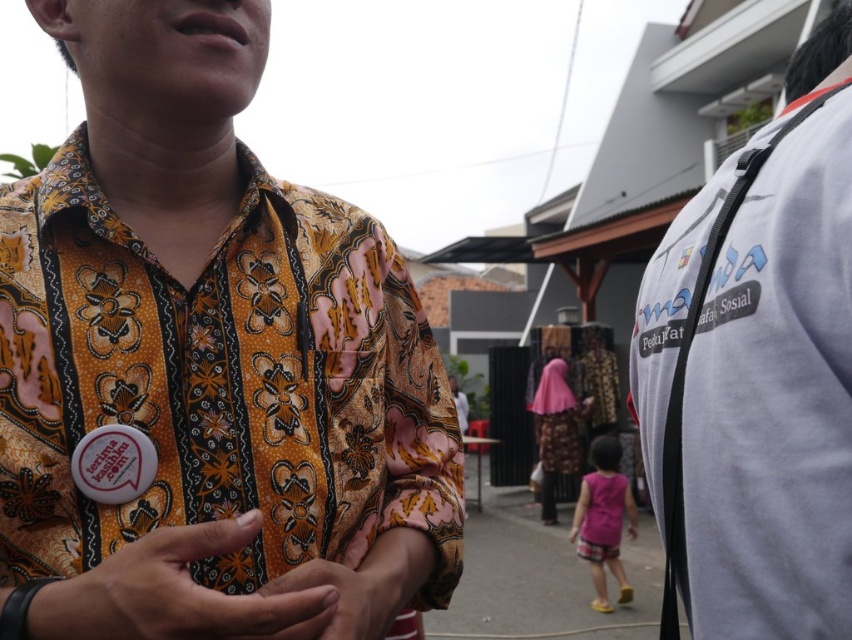
You are standing in the residential area scene and want to approach both the white fabric shirt at right and the matte floral shirt at center. Which one should you approach first to reach the one closer to you?

You should approach the white fabric shirt at right first because it is closer to you than the matte floral shirt at center.

You are a photographer trying to capture both the white fabric shirt at right and the pink fabric dress at lower center in a single shot. Which one should you focus on first to ensure both are in focus?

You should focus on the white fabric shirt at right first because it is closer to the viewer than the pink fabric dress at lower center, so adjusting focus from near to far will help both be in focus.